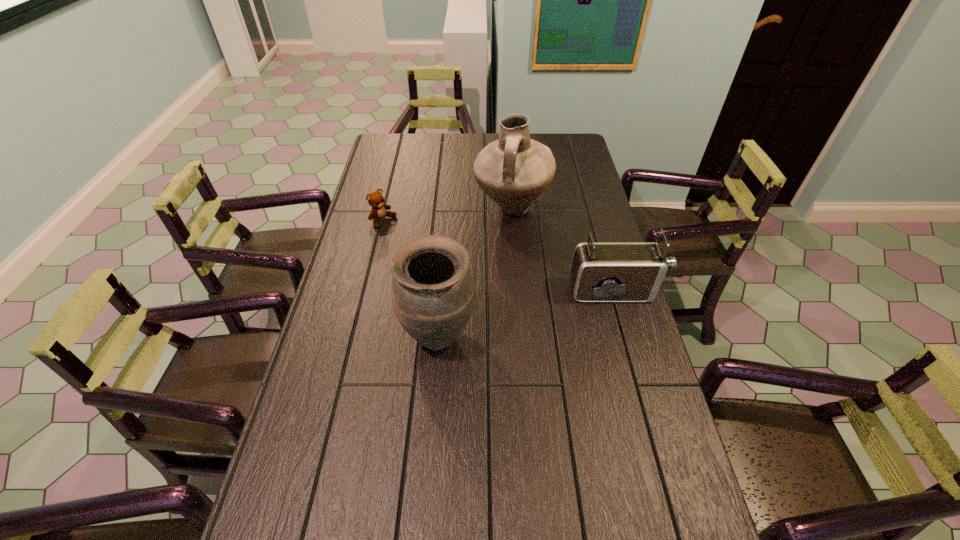
Find the location of `empty space that is in between the second tallest object and the camcorder`. empty space that is in between the second tallest object and the camcorder is located at coordinates (528, 314).

Identify the location of vacant region between the pitcher and the teddy bear. (447, 215).

Identify the location of unoccupied position between the leftmost object and the third tallest object. The width and height of the screenshot is (960, 540). (500, 256).

This screenshot has width=960, height=540. In order to click on vacant point located between the nearest object and the tallest object in this screenshot , I will do `click(474, 272)`.

Identify the location of blank region between the rightmost object and the second tallest object. This screenshot has width=960, height=540. (528, 314).

Find the location of `free space between the pitcher and the shortest object`. free space between the pitcher and the shortest object is located at coordinates (447, 215).

Locate an element on the screen. This screenshot has width=960, height=540. free space between the nearest object and the camcorder is located at coordinates coord(528,314).

At what (x,y) coordinates should I click in order to perform the action: click on free space that is in between the tallest object and the second tallest object. Please return your answer as a coordinate pair (x, y). Looking at the image, I should click on point(474,272).

Find the location of `free area in between the rightmost object and the pitcher`. free area in between the rightmost object and the pitcher is located at coordinates (564, 250).

Find the location of a particular element. The image size is (960, 540). object that is the second closest to the leftmost object is located at coordinates (432, 292).